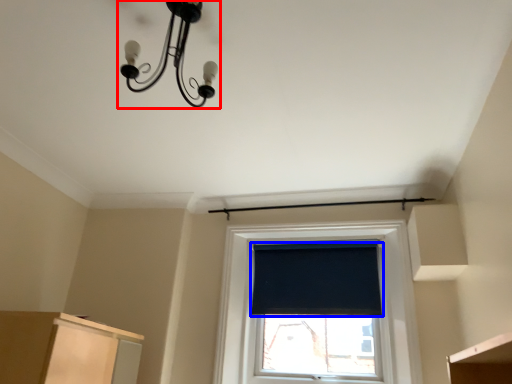
Question: Among these objects, which one is nearest to the camera, lamp (highlighted by a red box) or window screen (highlighted by a blue box)?

Choices:
 (A) lamp
 (B) window screen

Answer: (A)